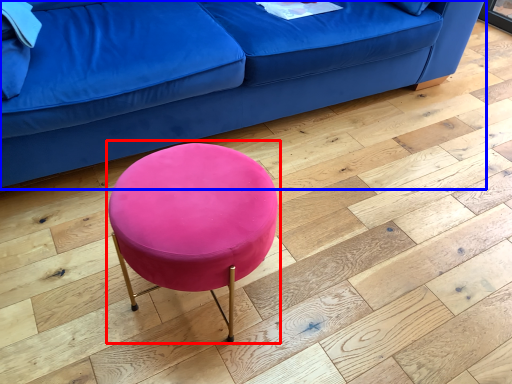
Question: Which object appears farthest to the camera in this image, bar stool (highlighted by a red box) or studio couch (highlighted by a blue box)?

Choices:
 (A) bar stool
 (B) studio couch

Answer: (B)